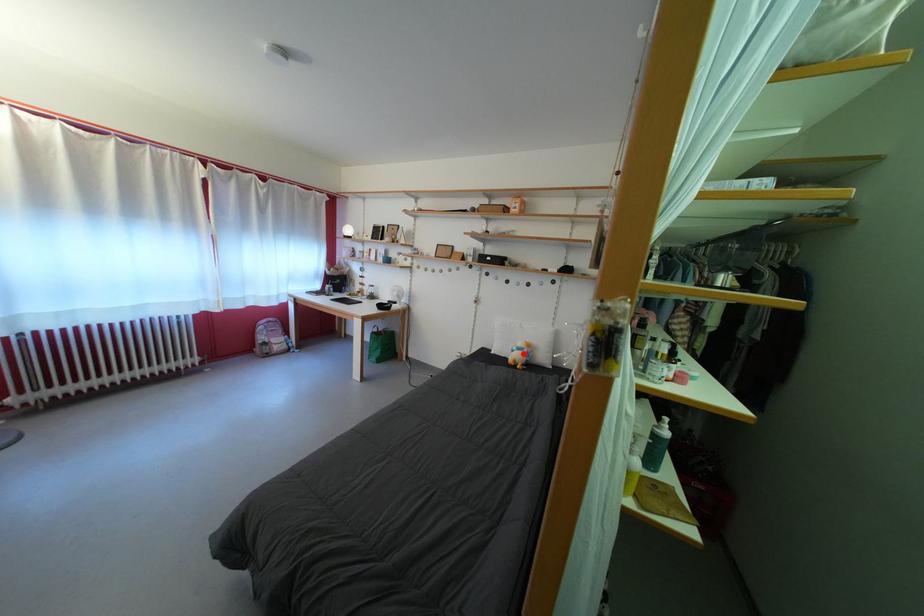
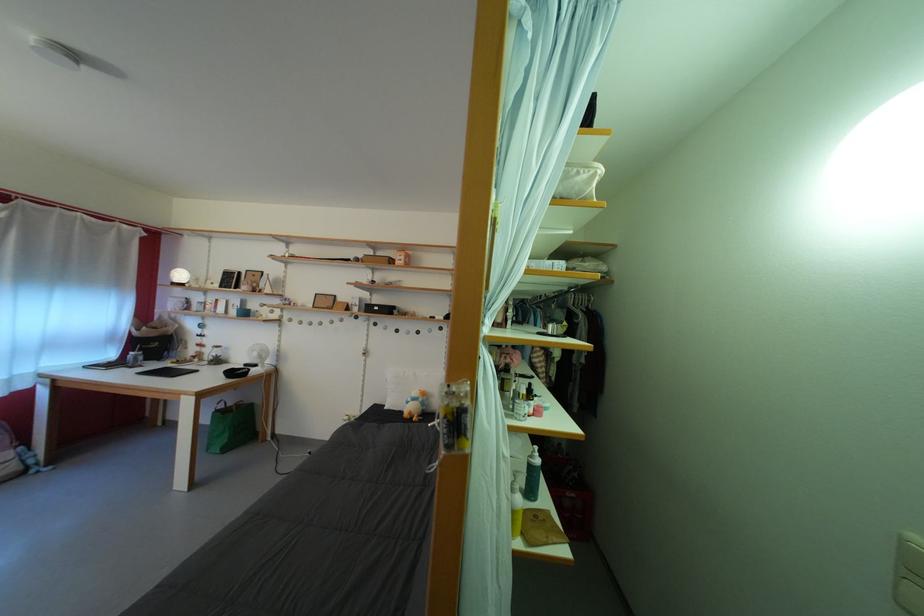
Question: I am providing you with two images of the same scene from different viewpoints. Image1 has a red point marked. In image2, the corresponding 3D location appears at what relative position? Reply with the corresponding letter.

Choices:
 (A) Closer
 (B) Farther

Answer: (B)